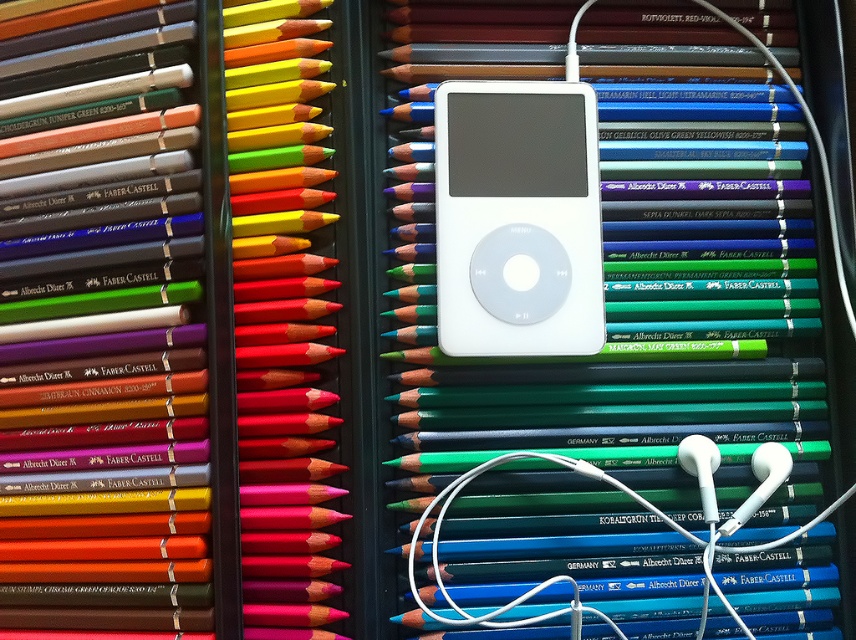
You are an artist who wants to place a 20 cm long ruler exactly between the green matte pencil at center and the matte red pencil at center. Will the ruler fit perfectly between them without overlapping either pencil?

The distance between the green matte pencil at center and the matte red pencil at center is 19.86 centimeters. Since the ruler is 20 cm long, it will be slightly longer than the space between them, causing it to overlap both pencils by 0.07 centimeters on each side.

You are an artist who wants to pick up the green matte pencil at center without touching the white matte ipod at center. Is this possible given their arrangement?

The green matte pencil at center is positioned under the white matte ipod at center, so you can carefully pick up the green matte pencil at center without touching the white matte ipod at center by reaching underneath it.